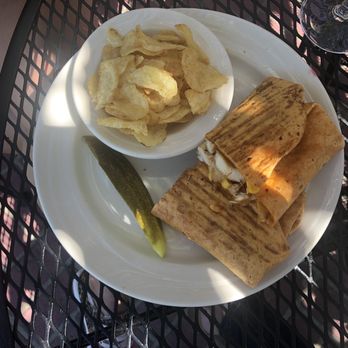
Where is `glass base`? Image resolution: width=348 pixels, height=348 pixels. glass base is located at coordinates (322, 38).